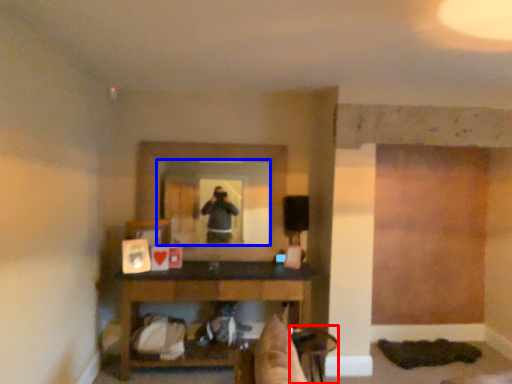
Question: Which object is closer to the camera taking this photo, chair (highlighted by a red box) or mirror (highlighted by a blue box)?

Choices:
 (A) chair
 (B) mirror

Answer: (A)